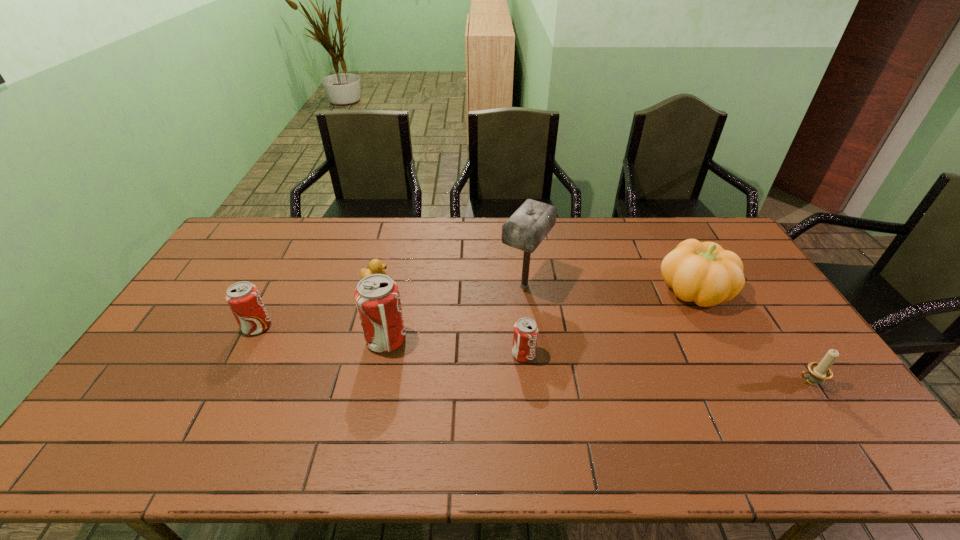
In order to click on pumpkin that is at the right edge in this screenshot , I will do `click(702, 272)`.

The width and height of the screenshot is (960, 540). Find the location of `candle_holder located at the right edge`. candle_holder located at the right edge is located at coordinates (818, 371).

This screenshot has width=960, height=540. I want to click on object present at the near right corner, so click(x=818, y=371).

I want to click on free region at the far edge of the desktop, so click(x=508, y=249).

In the image, there is a desktop. Identify the location of vacant space at the near edge. The height and width of the screenshot is (540, 960). (453, 389).

You are a GUI agent. You are given a task and a screenshot of the screen. Output one action in this format:
    pyautogui.click(x=<x>, y=<y>)
    Task: Click on the free region at the left edge of the desktop
    
    Given the screenshot: What is the action you would take?
    183,310

Where is `free location at the right edge`? Image resolution: width=960 pixels, height=540 pixels. free location at the right edge is located at coordinates (774, 326).

What are the coordinates of `vacant region between the mallet and the tallest soda can` in the screenshot? It's located at (455, 313).

You are a GUI agent. You are given a task and a screenshot of the screen. Output one action in this format:
    pyautogui.click(x=<x>, y=<y>)
    Task: Click on the free spot between the shortest object and the rightmost object
    
    Given the screenshot: What is the action you would take?
    pyautogui.click(x=592, y=331)

Locate an element on the screen. Image resolution: width=960 pixels, height=540 pixels. free area in between the leftmost soda can and the shortest object is located at coordinates (316, 303).